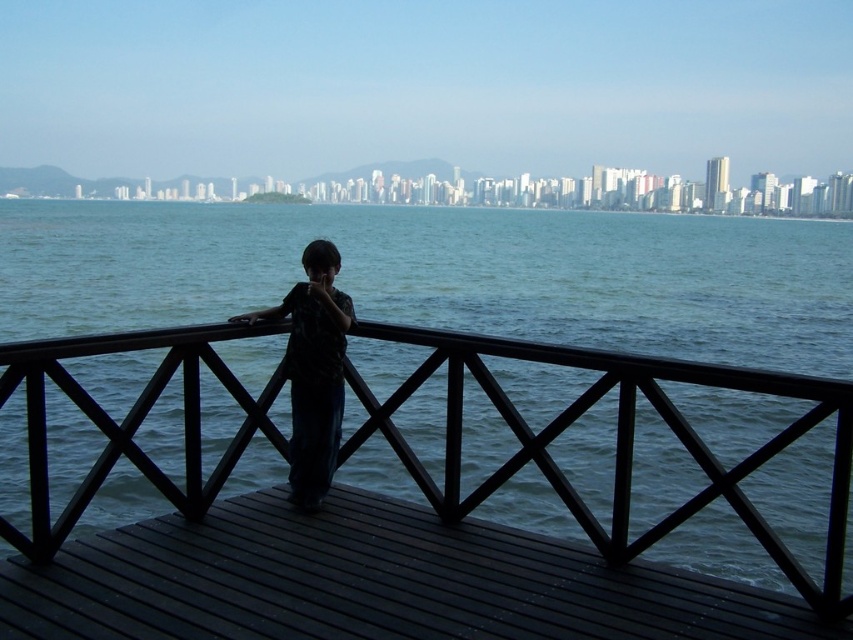
Question: Which object is positioned closest to the blue water at center?

Choices:
 (A) dark fabric shirt at center
 (B) black wood dock at center

Answer: (B)

Question: Which point is closer to the camera taking this photo?

Choices:
 (A) (122, 611)
 (B) (410, 355)

Answer: (A)

Question: Does black wood dock at center have a larger size compared to dark fabric shirt at center?

Choices:
 (A) yes
 (B) no

Answer: (A)

Question: Does black wood dock at center appear over dark fabric shirt at center?

Choices:
 (A) yes
 (B) no

Answer: (B)

Question: Which object is the farthest from the black wood dock at center?

Choices:
 (A) dark fabric shirt at center
 (B) blue water at center

Answer: (B)

Question: Is blue water at center below black wood dock at center?

Choices:
 (A) yes
 (B) no

Answer: (B)